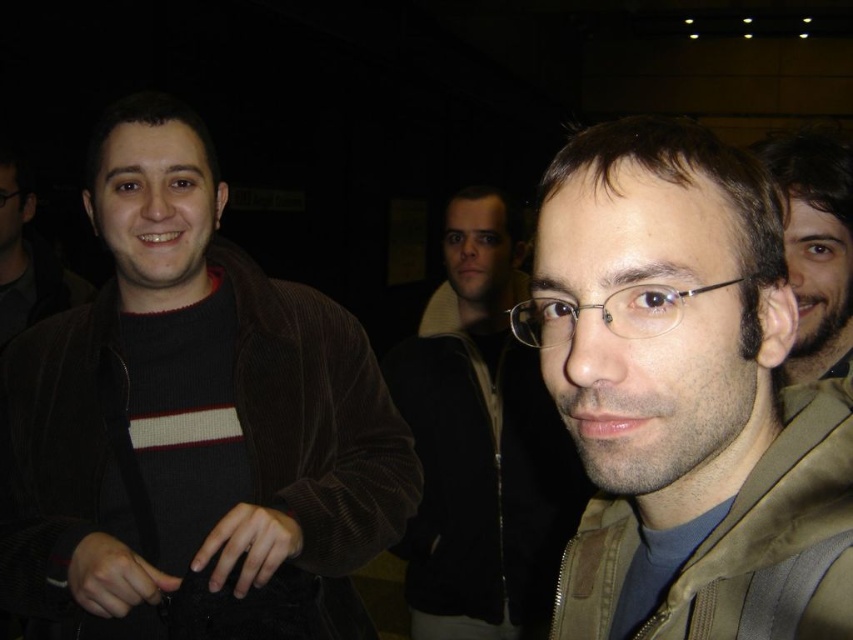
Question: Is khaki fabric jacket at lower right to the right of matte black glasses at left from the viewer's perspective?

Choices:
 (A) no
 (B) yes

Answer: (B)

Question: Estimate the real-world distances between objects in this image. Which object is farther from the matte black jacket at center?

Choices:
 (A) brown corduroy jacket at left
 (B) matte khaki jacket at center

Answer: (B)

Question: Which point is farther to the camera?

Choices:
 (A) (544, 429)
 (B) (587, 628)

Answer: (A)

Question: Is matte black jacket at center bigger than beige fabric jacket at upper right?

Choices:
 (A) yes
 (B) no

Answer: (B)

Question: Among these points, which one is farthest from the camera?

Choices:
 (A) coord(207,272)
 (B) coord(728,636)
 (C) coord(836,243)
 (D) coord(561,310)

Answer: (A)

Question: Can you confirm if brown corduroy jacket at left is thinner than matte black glasses at left?

Choices:
 (A) no
 (B) yes

Answer: (A)